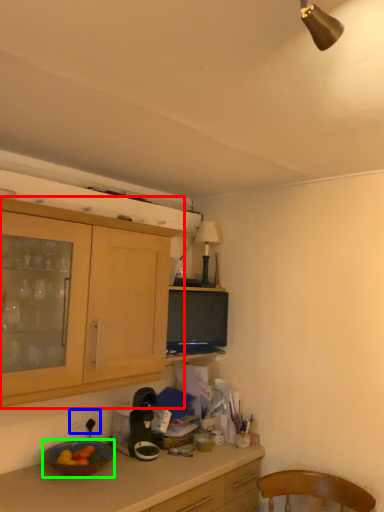
Question: Which is nearer to the cabinetry (highlighted by a red box)? power outlet (highlighted by a blue box) or bowl (highlighted by a green box).

Choices:
 (A) power outlet
 (B) bowl

Answer: (B)